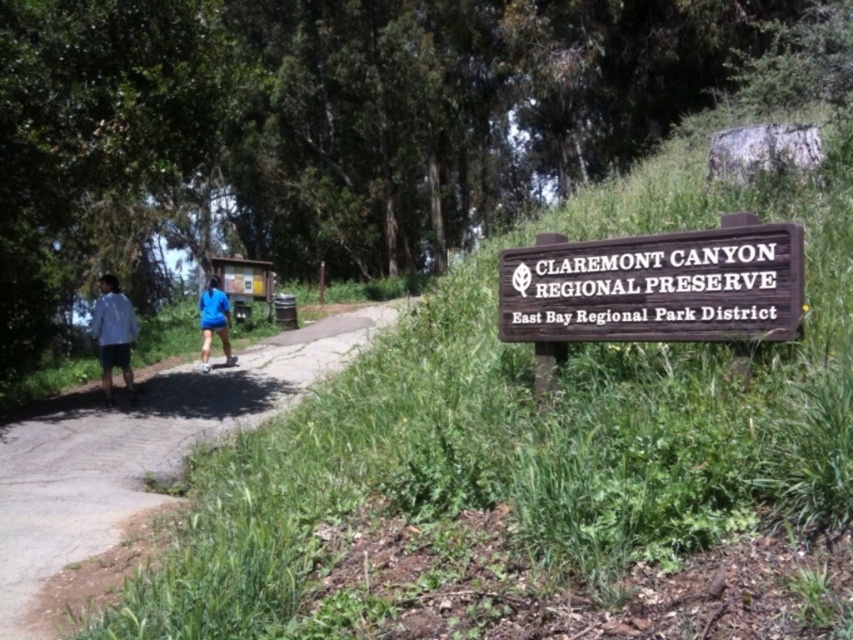
Looking at this image, you are a photographer standing at the Claremont Canyon Regional Preserve sign. You notice a person wearing a blue fabric jacket at left and a blue fabric shorts at center. Which clothing item is wider from your perspective?

The blue fabric jacket at left might be wider than blue fabric shorts at center.

You are planning a hike at Claremont Canyon Regional Preserve and see the gravel path at center and the light blue shirt at left. Which object is positioned lower in the image?

The gravel path at center is located below the light blue shirt at left, so the gravel path at center is positioned lower in the image.